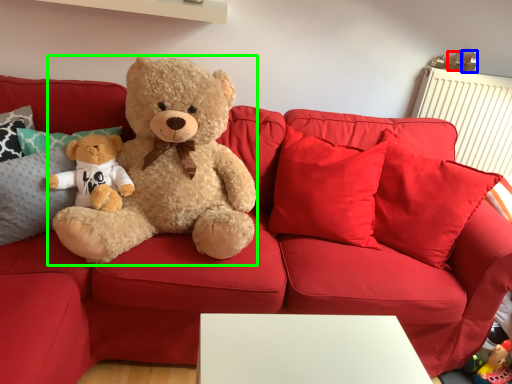
Question: Which is farther away from toy (highlighted by a red box)? toy (highlighted by a blue box) or teddy bear (highlighted by a green box)?

Choices:
 (A) toy
 (B) teddy bear

Answer: (B)